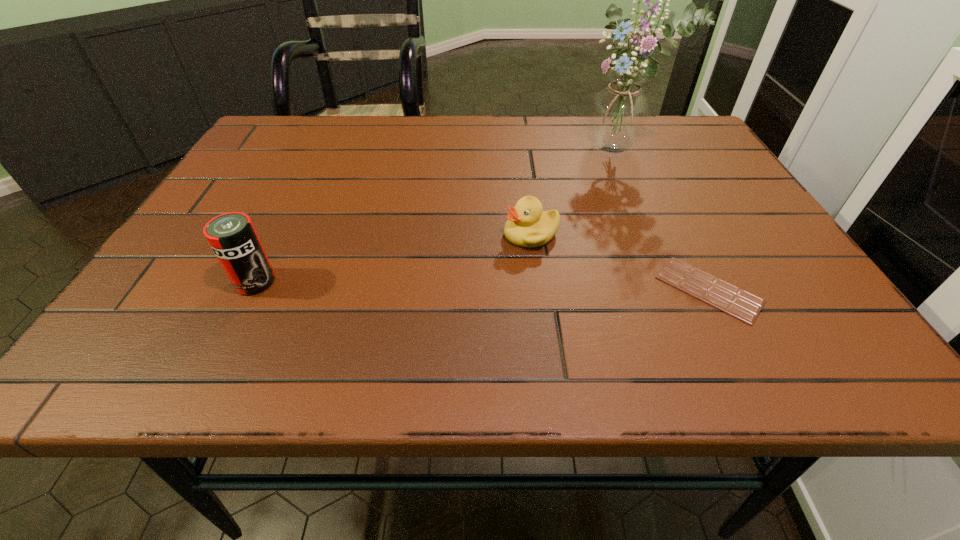
You are a GUI agent. You are given a task and a screenshot of the screen. Output one action in this format:
    pyautogui.click(x=<x>, y=<y>)
    Task: Click on the free space between the leftmost object and the shortest object
    
    Given the screenshot: What is the action you would take?
    pyautogui.click(x=482, y=286)

Where is `free spot between the second object from left to right and the chocolate bar`? Image resolution: width=960 pixels, height=540 pixels. free spot between the second object from left to right and the chocolate bar is located at coordinates (620, 261).

Where is `vacant space in between the tallest object and the leftmost object`? This screenshot has width=960, height=540. vacant space in between the tallest object and the leftmost object is located at coordinates (437, 215).

Identify the location of vacant space that is in between the third shortest object and the chocolate bar. (482, 286).

Where is `free area in between the can and the chocolate bar`? free area in between the can and the chocolate bar is located at coordinates (482, 286).

At what (x,y) coordinates should I click in order to perform the action: click on free space between the farthest object and the second shortest object. Please return your answer as a coordinate pair (x, y). The height and width of the screenshot is (540, 960). Looking at the image, I should click on (575, 192).

What are the coordinates of `vacant space that's between the second farthest object and the chocolate bar` in the screenshot? It's located at (620, 261).

Where is `unoccupied position between the shortest object and the leftmost object`? This screenshot has width=960, height=540. unoccupied position between the shortest object and the leftmost object is located at coordinates (482, 286).

Image resolution: width=960 pixels, height=540 pixels. I want to click on blank region between the duckling and the leftmost object, so [393, 258].

Identify the location of object identified as the second closest to the duckling. (618, 117).